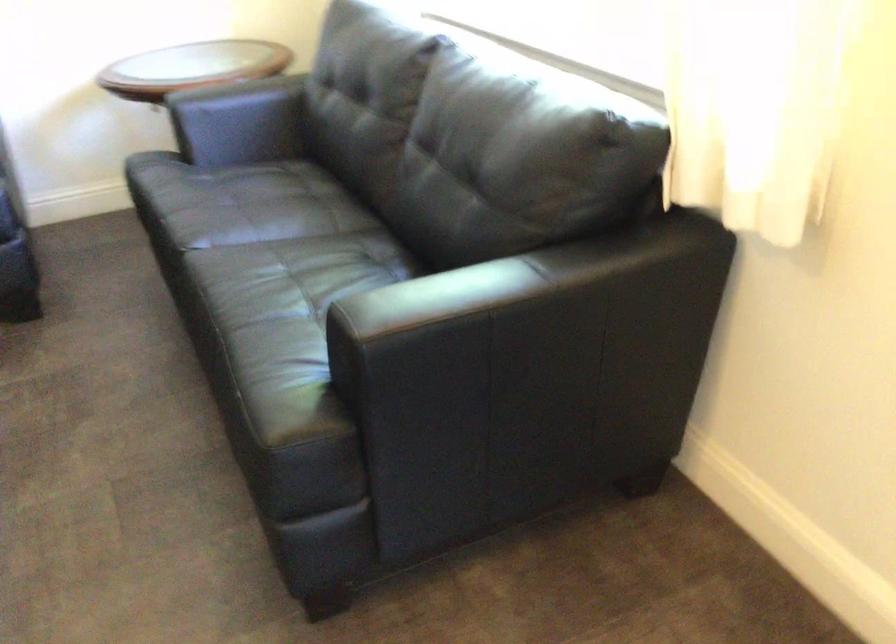
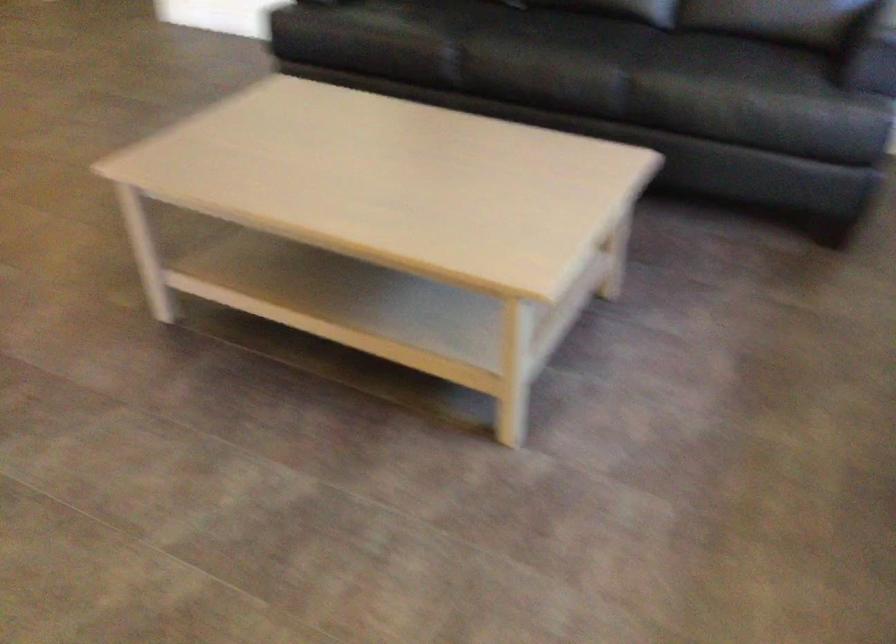
How did the camera likely rotate?

The rotation direction of the camera is left-down.